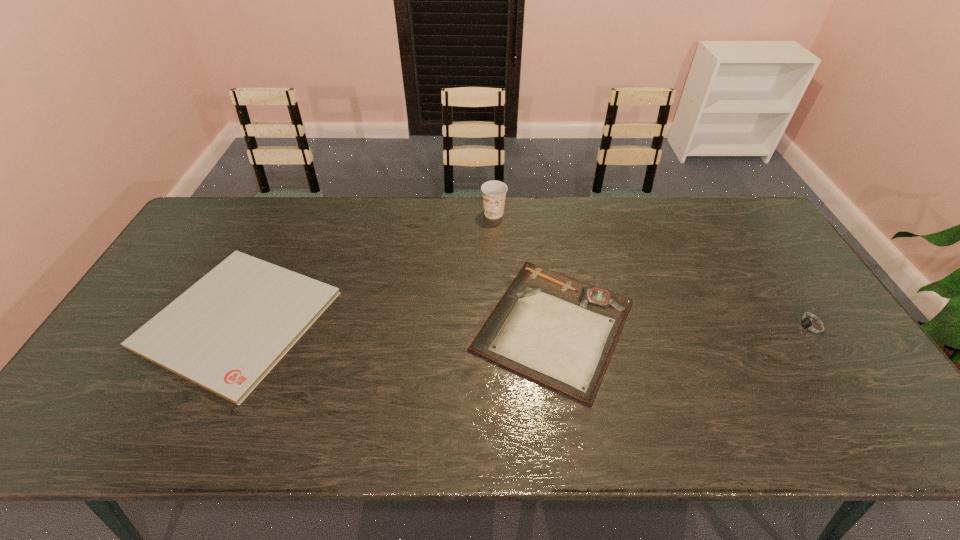
Where is `vacant space that's between the right clipboard and the leftmost object`? The width and height of the screenshot is (960, 540). vacant space that's between the right clipboard and the leftmost object is located at coordinates (396, 322).

The height and width of the screenshot is (540, 960). Find the location of `free space between the leftmost object and the tallest object`. free space between the leftmost object and the tallest object is located at coordinates (366, 266).

I want to click on free area in between the farthest object and the left clipboard, so click(366, 266).

Locate an element on the screen. free space between the farthest object and the rightmost object is located at coordinates (653, 270).

The height and width of the screenshot is (540, 960). In order to click on unoccupied position between the right clipboard and the second tallest object in this screenshot , I will do `click(683, 326)`.

Locate an element on the screen. Image resolution: width=960 pixels, height=540 pixels. vacant point located between the tallest object and the leftmost object is located at coordinates (366, 266).

Where is `the third closest object relative to the left clipboard`? This screenshot has height=540, width=960. the third closest object relative to the left clipboard is located at coordinates (809, 325).

Identify the location of the closest object relative to the leftmost object. Image resolution: width=960 pixels, height=540 pixels. (559, 331).